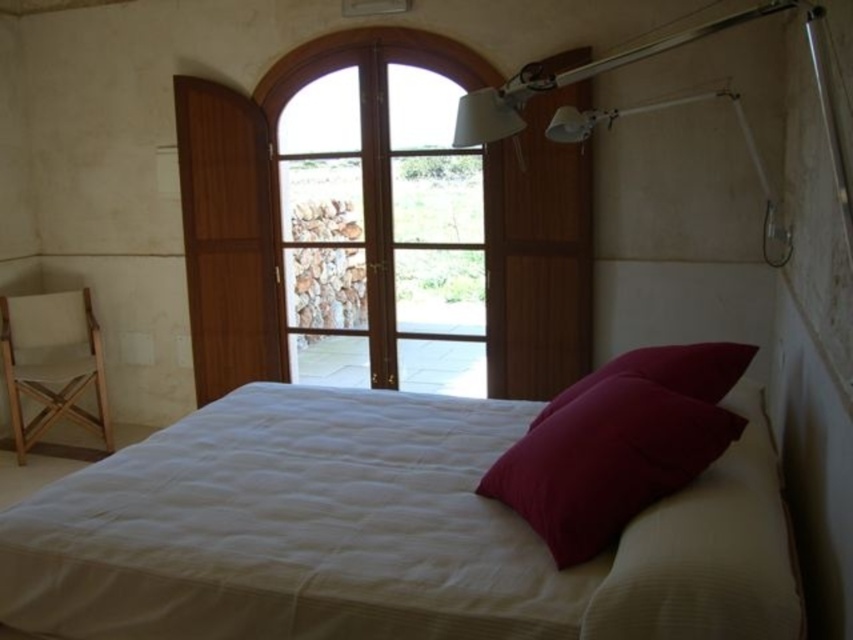
Does clear glass door at center appear on the left side of white matte lamp at upper center?

Correct, you'll find clear glass door at center to the left of white matte lamp at upper center.

Does clear glass door at center have a greater width compared to white matte lamp at upper center?

Correct, the width of clear glass door at center exceeds that of white matte lamp at upper center.

What do you see at coordinates (380, 216) in the screenshot?
I see `clear glass door at center` at bounding box center [380, 216].

Locate an element on the screen. The image size is (853, 640). clear glass door at center is located at coordinates (380, 216).

Does white quilted bed at center have a lesser width compared to velvet red pillow at center?

No, white quilted bed at center is not thinner than velvet red pillow at center.

Who is taller, white quilted bed at center or velvet red pillow at center?

white quilted bed at center

You are a GUI agent. You are given a task and a screenshot of the screen. Output one action in this format:
    pyautogui.click(x=<x>, y=<y>)
    Task: Click on the white quilted bed at center
    The width and height of the screenshot is (853, 640).
    Given the screenshot: What is the action you would take?
    pyautogui.click(x=381, y=534)

Where is `white quilted bed at center`? white quilted bed at center is located at coordinates (381, 534).

Does white quilted bed at center have a lesser width compared to matte pink pillow at upper right?

In fact, white quilted bed at center might be wider than matte pink pillow at upper right.

This screenshot has height=640, width=853. Find the location of `white quilted bed at center`. white quilted bed at center is located at coordinates (381, 534).